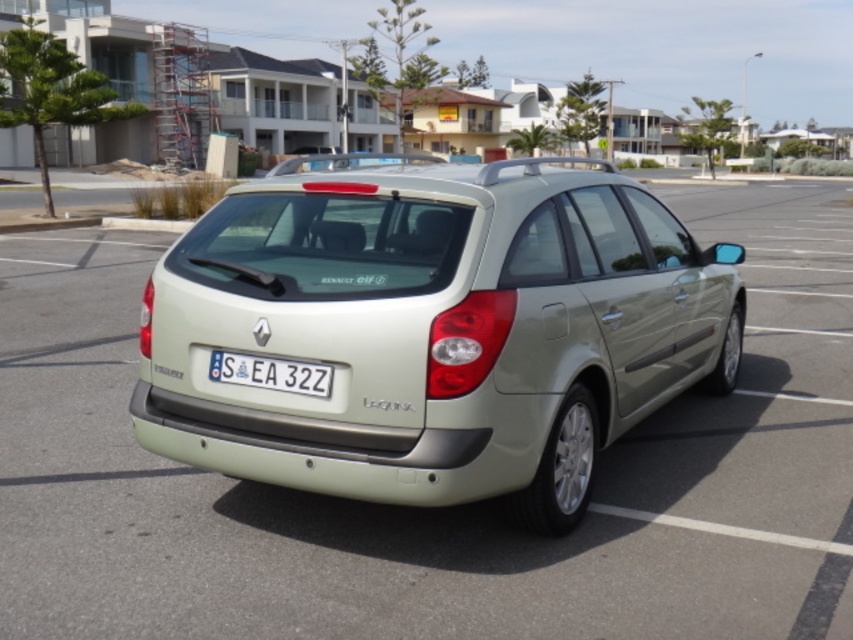
You are a parking attendant and need to ensure that the satin beige hatchback at center can fit into a reserved parking spot that is exactly the same size as the white plastic license plate at center. Based on the scene, will the car fit?

The satin beige hatchback at center is larger in size than the white plastic license plate at center, so it will not fit into the reserved parking spot that is the same size as the license plate.

You are a delivery driver who needs to attach a package to the roof rack of the satin beige hatchback at center. However, you notice the white plastic license plate at center might interfere with the package. Based on their positions, can you determine if the license plate is below the hatchback where the package will be placed?

The satin beige hatchback at center is located above the white plastic license plate at center, so the license plate is positioned below the hatchback. This means the license plate will not interfere with placing the package on the roof rack of the satin beige hatchback at center.